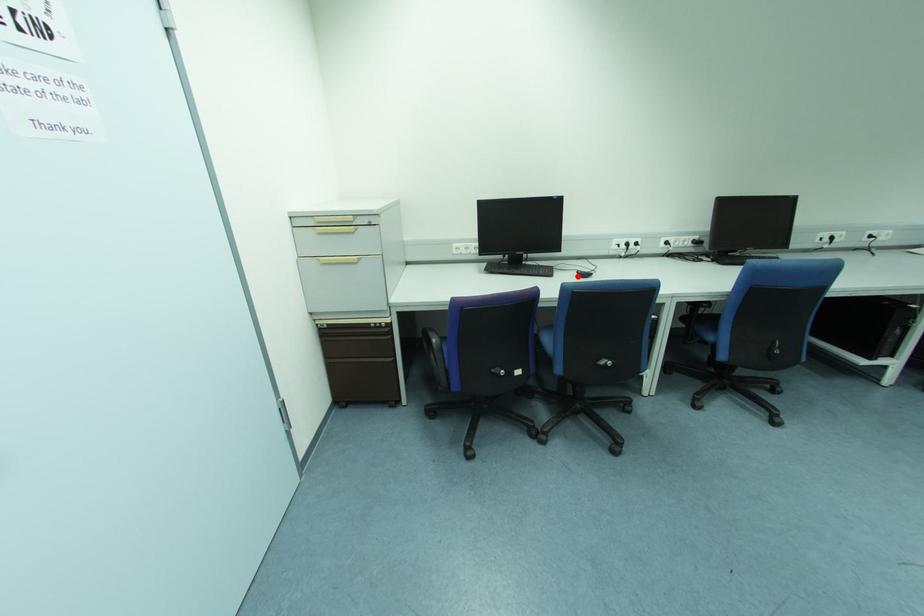
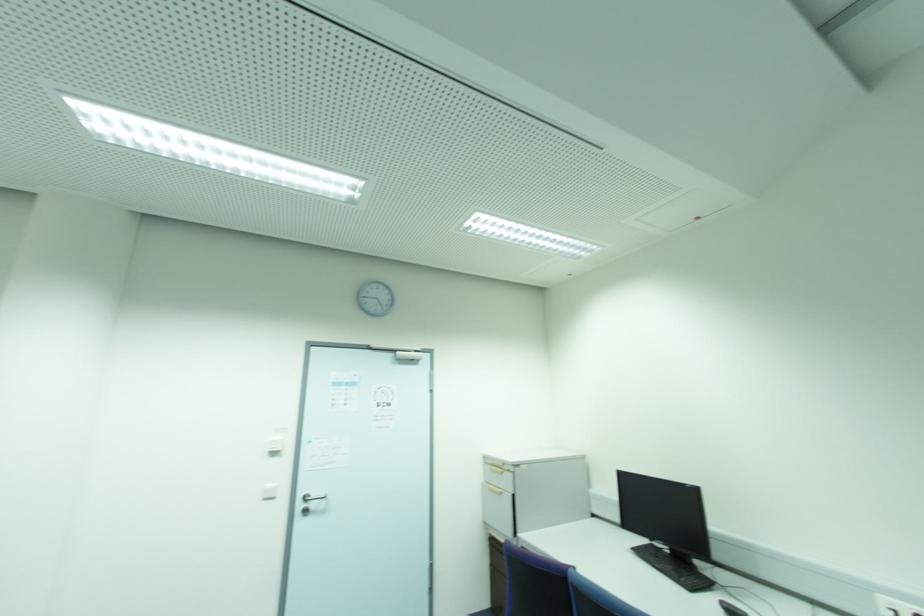
The point at the highlighted location is marked in the first image. Where is the corresponding point in the second image?

(723, 610)